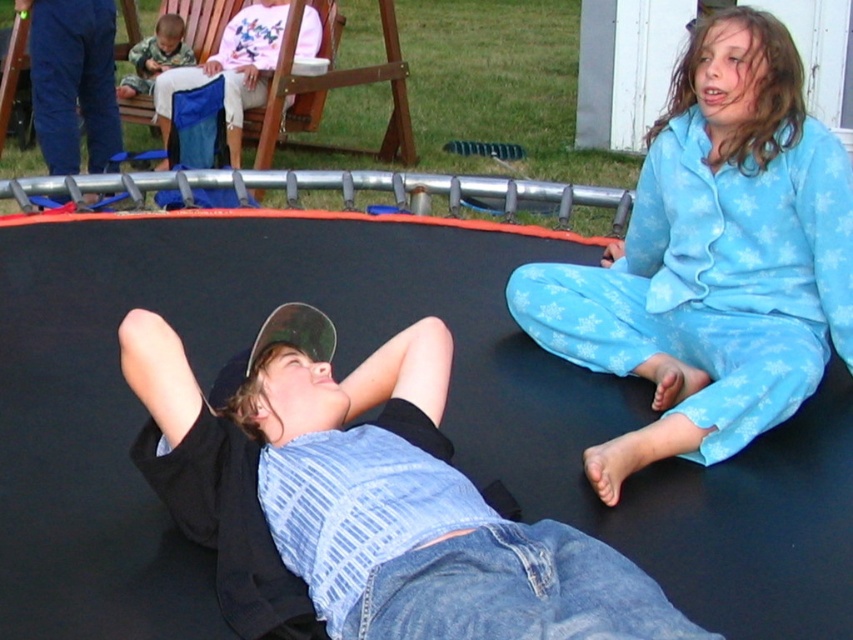
Question: Does denim shirt at center have a greater width compared to blue fleece pajamas at upper right?

Choices:
 (A) no
 (B) yes

Answer: (B)

Question: From the image, what is the correct spatial relationship of blue fleece pajamas at upper right in relation to camouflage fabric shirt at upper left?

Choices:
 (A) right
 (B) left

Answer: (A)

Question: Among these objects, which one is nearest to the camera?

Choices:
 (A) blue fleece pajamas at upper right
 (B) camouflage fabric shirt at upper left

Answer: (A)

Question: Which point appears farthest from the camera in this image?

Choices:
 (A) (251, 452)
 (B) (717, 40)

Answer: (B)

Question: Which point is closer to the camera?

Choices:
 (A) blue fleece pajamas at upper right
 (B) camouflage fabric shirt at upper left

Answer: (A)

Question: Does blue fleece pajamas at upper right appear on the left side of camouflage fabric shirt at upper left?

Choices:
 (A) yes
 (B) no

Answer: (B)